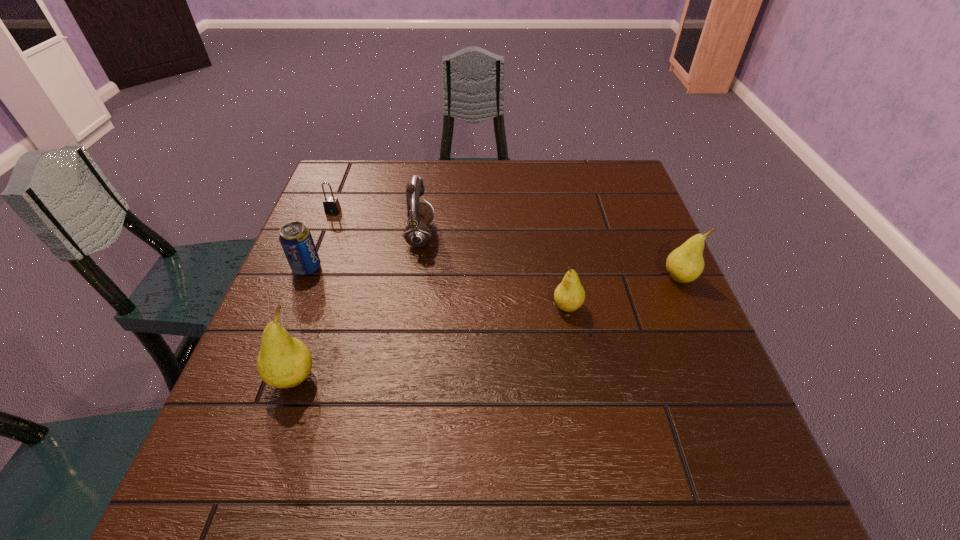
Identify the location of the nearest object. (283, 362).

Image resolution: width=960 pixels, height=540 pixels. What are the coordinates of `the leftmost pear` in the screenshot? It's located at (283, 362).

This screenshot has height=540, width=960. What are the coordinates of `the second nearest object` in the screenshot? It's located at (569, 295).

I want to click on the shortest pear, so (569, 295).

Where is `the farthest pear`? Image resolution: width=960 pixels, height=540 pixels. the farthest pear is located at coordinates (684, 264).

The width and height of the screenshot is (960, 540). What are the coordinates of `the rightmost object` in the screenshot? It's located at (684, 264).

You are a GUI agent. You are given a task and a screenshot of the screen. Output one action in this format:
    pyautogui.click(x=<x>, y=<y>)
    Task: Click on the soda
    The image size is (960, 540).
    Given the screenshot: What is the action you would take?
    pyautogui.click(x=296, y=240)

The image size is (960, 540). Identify the location of the fourth object from left to right. (417, 234).

What are the coordinates of `earphone` in the screenshot? It's located at (417, 234).

The width and height of the screenshot is (960, 540). I want to click on the farthest object, so click(x=331, y=204).